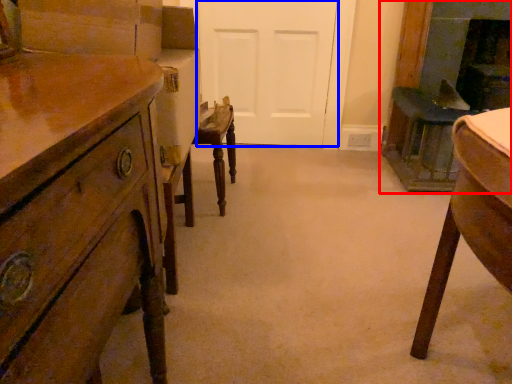
Question: Among these objects, which one is farthest to the camera, fireplace (highlighted by a red box) or door (highlighted by a blue box)?

Choices:
 (A) fireplace
 (B) door

Answer: (B)